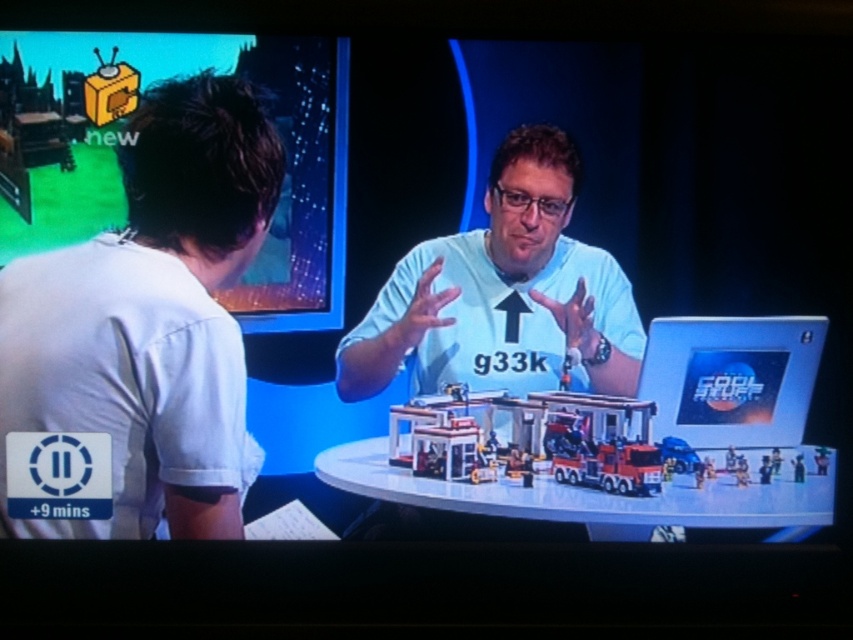
Question: Can you confirm if matte plastic tv at upper left is smaller than light blue t-shirt at center?

Choices:
 (A) yes
 (B) no

Answer: (B)

Question: Which of the following is the farthest from the observer?

Choices:
 (A) silver metallic laptop at right
 (B) white glossy table at center
 (C) light blue t-shirt at center

Answer: (B)

Question: Is white cotton shirt at left to the left of matte plastic tv at upper left from the viewer's perspective?

Choices:
 (A) no
 (B) yes

Answer: (B)

Question: Can you confirm if matte plastic tv at upper left is thinner than plastic toy car at center?

Choices:
 (A) yes
 (B) no

Answer: (B)

Question: Estimate the real-world distances between objects in this image. Which object is farther from the matte plastic tv at upper left?

Choices:
 (A) white cotton shirt at left
 (B) light blue t-shirt at center
 (C) plastic toy car at center

Answer: (C)

Question: Among these objects, which one is nearest to the camera?

Choices:
 (A) white glossy table at center
 (B) matte plastic tv at upper left

Answer: (B)